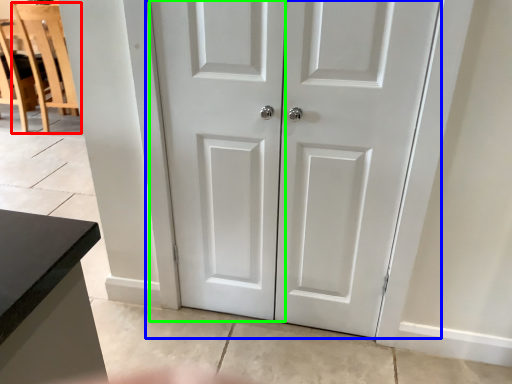
Question: Which object is the closest to the chair (highlighted by a red box)? Choose among these: door (highlighted by a blue box) or screen door (highlighted by a green box).

Choices:
 (A) door
 (B) screen door

Answer: (B)